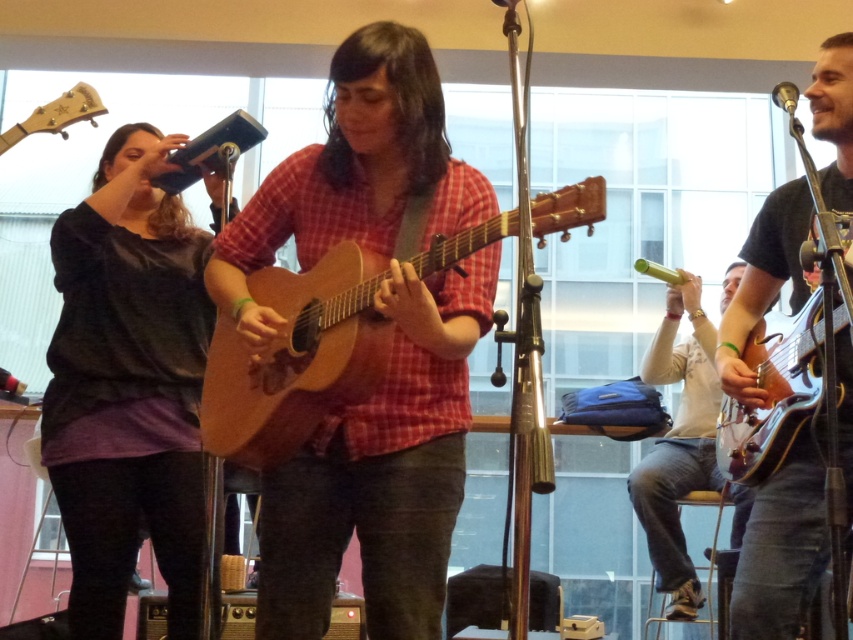
You are a stagehand setting up equipment for the performance. There is a matte black guitar at right that needs to be moved to the center stage. Based on its current position at point coordinates, can you determine if it is positioned to the right or left of the center stage?

The matte black guitar at right is located at point coordinates, which is to the right of the center stage.

You are a photographer trying to capture the best shot of the performance. You notice two points in the image at coordinates point (782, 570) and point (677, 556). Which of these points is closer to your camera lens?

Point (782, 570) is closer to the camera than point (677, 556).

You are a stagehand setting up for a concert. You need to place a 36 inch wide amplifier between the wooden acoustic guitar at center and the matte black guitar at right. Can you fit it there?

The wooden acoustic guitar at center and matte black guitar at right are 30.94 inches apart. Since the amplifier is 36 inches wide, it cannot fit between them as the space is narrower than the amplifier.